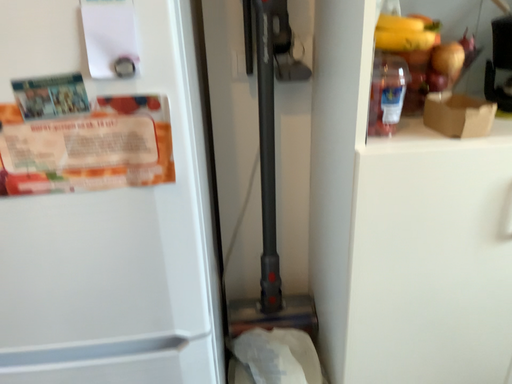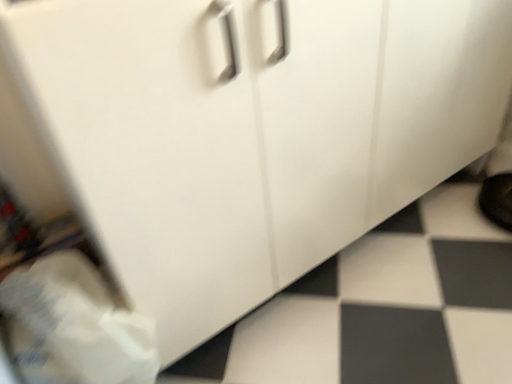
Question: How did the camera likely rotate when shooting the video?

Choices:
 (A) rotated right
 (B) rotated left

Answer: (A)